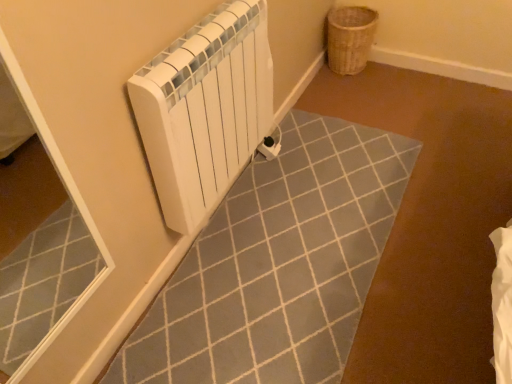
Where is `vacant space situated above woven brown basket at upper right (from a real-world perspective)`? vacant space situated above woven brown basket at upper right (from a real-world perspective) is located at coordinates (350, 14).